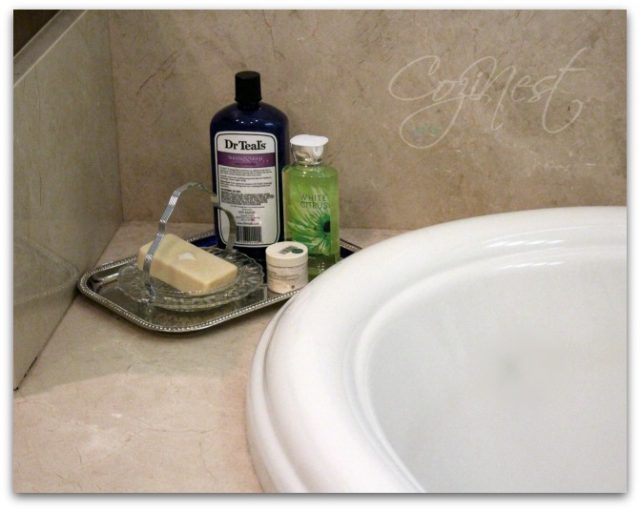
Where is `sink`? The height and width of the screenshot is (510, 640). sink is located at coordinates (541, 398).